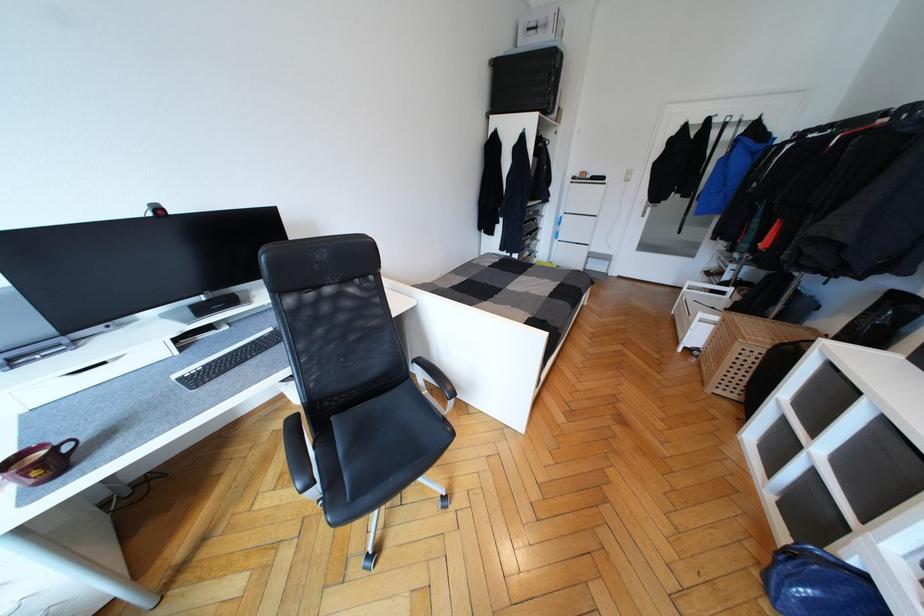
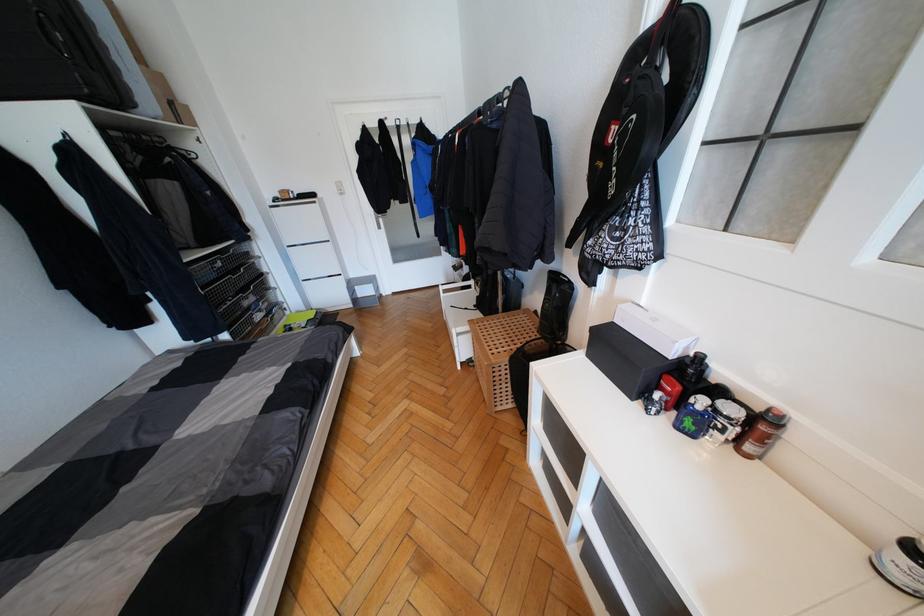
Where in the second image is the point corresponding to (x=714, y=329) from the first image?

(472, 338)